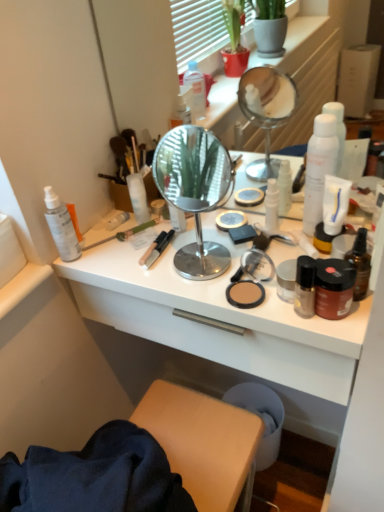
Question: Looking at their shapes, would you say polished chrome mirror at center is wider or thinner than matte gold jar at center right, the 1th toiletry positioned from the right?

Choices:
 (A) wide
 (B) thin

Answer: (A)

Question: From the image's perspective, relative to matte gold jar at center right, which ranks as the eighth toiletry in left-to-right order, is polished chrome mirror at center above or below?

Choices:
 (A) below
 (B) above

Answer: (B)

Question: Which is farther from the brown matte jar at right, the second toiletry viewed from the right?

Choices:
 (A) white matte bottle at center, the 5th toiletry viewed from the right
 (B) polished chrome mirror at center
 (C) translucent plastic spray bottle at left, the 1th toiletry when ordered from left to right
 (D) white glossy desk at center
 (E) white matte spray can at left, marked as the second toiletry in a left-to-right arrangement

Answer: (B)

Question: Which object is positioned farthest from the clear plastic tube at center, marked as the sixth toiletry in a right-to-left arrangement?

Choices:
 (A) white glossy bottle at center, the 5th toiletry viewed from the left
 (B) brown glass bottle at right, which is counted as the second bottle, starting from the back
 (C) translucent plastic spray bottle at left, which is the eighth toiletry in right-to-left order
 (D) satin black nail polish at right, the third toiletry when ordered from right to left
 (E) white matte bottle at center, the 4th toiletry positioned from the left

Answer: (B)